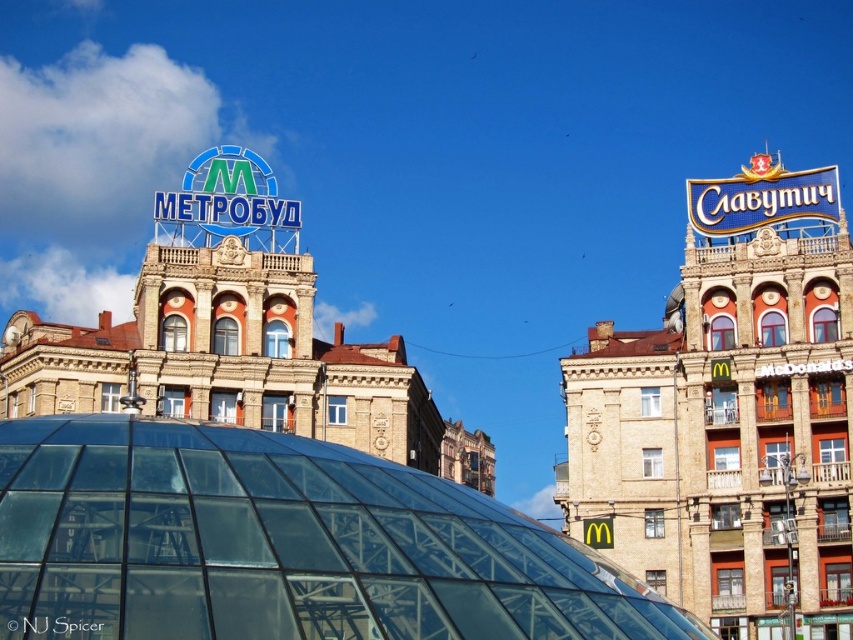
Is transparent glass dome at center below blue metallic signboard at upper right?

Yes, transparent glass dome at center is below blue metallic signboard at upper right.

Can you confirm if transparent glass dome at center is taller than blue metallic signboard at upper right?

In fact, transparent glass dome at center may be shorter than blue metallic signboard at upper right.

Is point (341, 518) positioned behind point (785, 230)?

That is False.

I want to click on transparent glass dome at center, so click(280, 545).